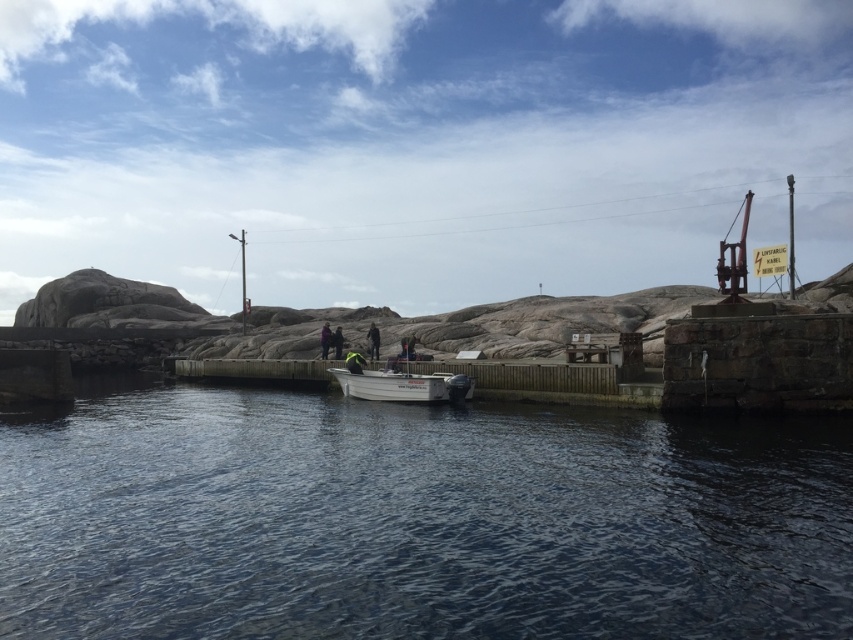
Question: In this image, where is white matte boat at center located relative to green fabric jacket at center?

Choices:
 (A) left
 (B) right

Answer: (B)

Question: Is dark blue water at center positioned at the back of green fabric jacket at center?

Choices:
 (A) yes
 (B) no

Answer: (B)

Question: Is dark blue water at center further to the viewer compared to dark blue jacket at center?

Choices:
 (A) no
 (B) yes

Answer: (A)

Question: Among these objects, which one is nearest to the camera?

Choices:
 (A) dark green fabric jacket at center
 (B) dark blue jacket at center
 (C) dark blue water at center

Answer: (C)

Question: Which point is closer to the camera?

Choices:
 (A) (323, 336)
 (B) (335, 346)
 (C) (440, 372)

Answer: (C)

Question: Considering the real-world distances, which object is farthest from the dark green fabric jacket at center?

Choices:
 (A) dark blue jacket at center
 (B) green fabric jacket at center
 (C) dark blue water at center

Answer: (C)